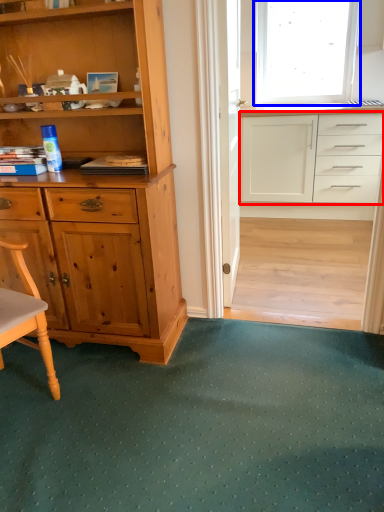
Question: Which of the following is the farthest to the observer, cabinetry (highlighted by a red box) or window (highlighted by a blue box)?

Choices:
 (A) cabinetry
 (B) window

Answer: (B)